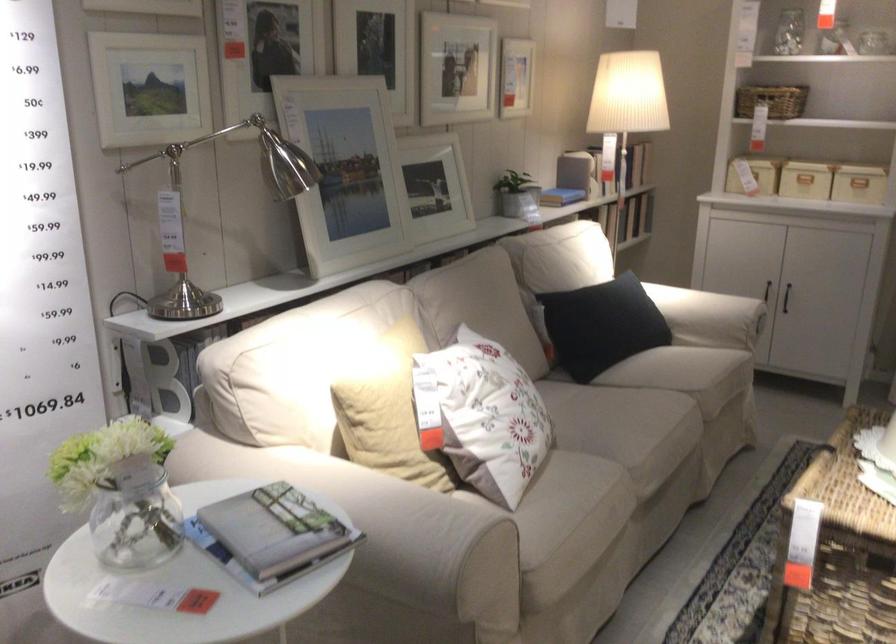
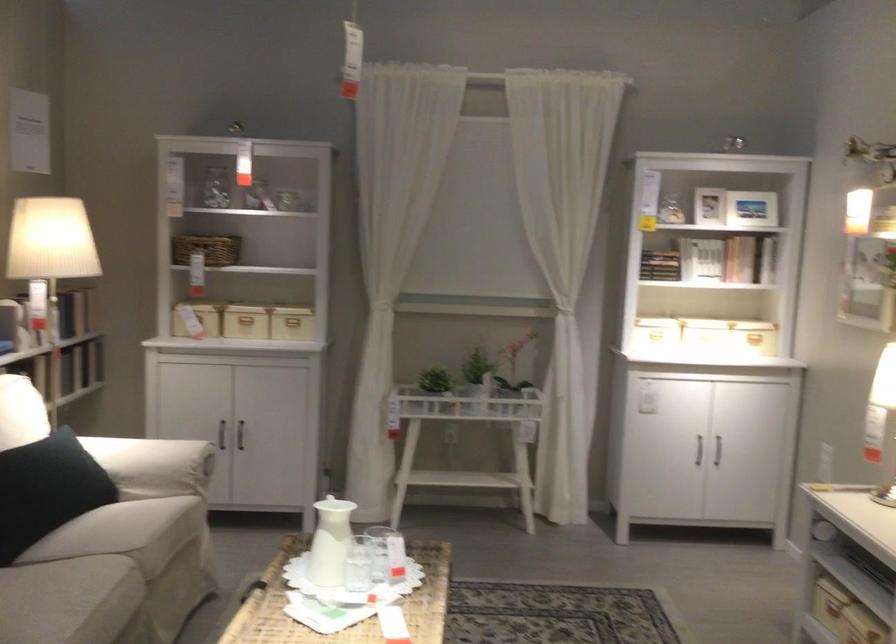
Question: I am providing you with two images of the same scene from different viewpoints. Please identify which objects are invisible in image2.

Choices:
 (A) dark cabinet handle
 (B) wicker storage basket
 (C) black power plug
 (D) black cabinet handle

Answer: (D)